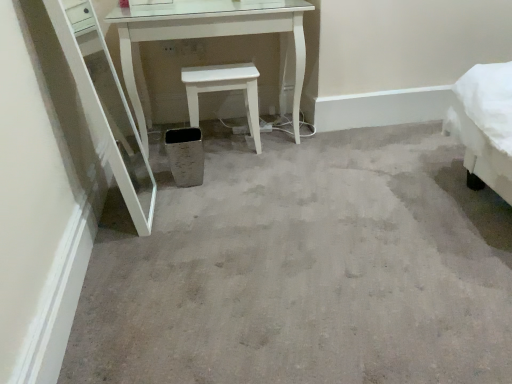
Question: From the image's perspective, is metallic gray trash bin/can at center above or below white matte stool at center?

Choices:
 (A) above
 (B) below

Answer: (B)

Question: Considering the positions of metallic gray trash bin/can at center and white matte stool at center in the image, is metallic gray trash bin/can at center bigger or smaller than white matte stool at center?

Choices:
 (A) small
 (B) big

Answer: (A)

Question: Considering the positions of metallic gray trash bin/can at center and white matte stool at center in the image, is metallic gray trash bin/can at center wider or thinner than white matte stool at center?

Choices:
 (A) thin
 (B) wide

Answer: (A)

Question: In terms of width, does white matte stool at center look wider or thinner when compared to metallic gray trash bin/can at center?

Choices:
 (A) thin
 (B) wide

Answer: (B)

Question: Would you say white matte stool at center is to the left or to the right of metallic gray trash bin/can at center in the picture?

Choices:
 (A) right
 (B) left

Answer: (A)

Question: From a real-world perspective, relative to metallic gray trash bin/can at center, is white matte stool at center vertically above or below?

Choices:
 (A) below
 (B) above

Answer: (B)

Question: From the image's perspective, relative to metallic gray trash bin/can at center, is white matte stool at center above or below?

Choices:
 (A) above
 (B) below

Answer: (A)